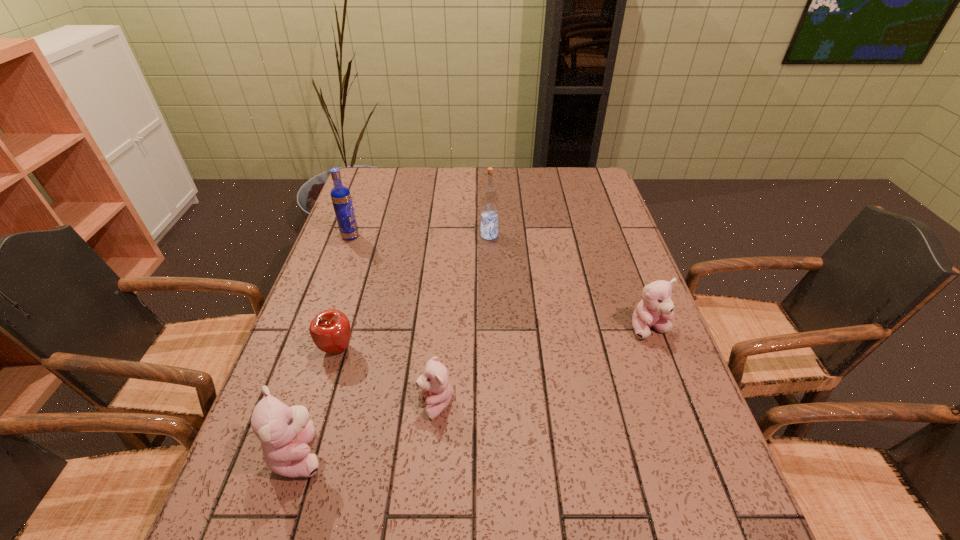
Identify which teddy bear is the second nearest to the apple. Please provide its 2D coordinates. Your answer should be formatted as a tuple, i.e. [(x, y)], where the tuple contains the x and y coordinates of a point satisfying the conditions above.

[(434, 384)]

Where is `free point that satisfies the following two spatial constraints: 1. on the front side of the apple; 2. on the right side of the left vodka`? The image size is (960, 540). free point that satisfies the following two spatial constraints: 1. on the front side of the apple; 2. on the right side of the left vodka is located at coordinates (310, 348).

You are a GUI agent. You are given a task and a screenshot of the screen. Output one action in this format:
    pyautogui.click(x=<x>, y=<y>)
    Task: Click on the vacant area in the image that satisfies the following two spatial constraints: 1. at the face of the rightmost teddy bear; 2. at the face of the fourth object from left to right
    The width and height of the screenshot is (960, 540).
    Given the screenshot: What is the action you would take?
    pyautogui.click(x=679, y=404)